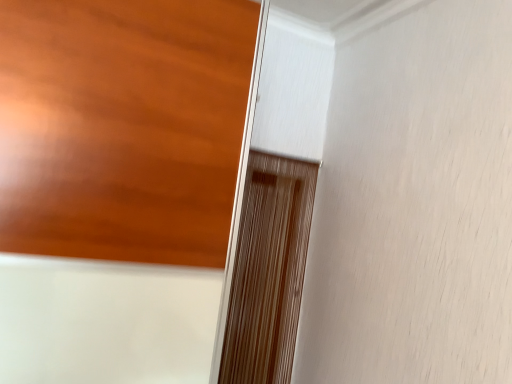
Where is `wooden screen door at center`? This screenshot has width=512, height=384. wooden screen door at center is located at coordinates (268, 270).

The width and height of the screenshot is (512, 384). Describe the element at coordinates (268, 270) in the screenshot. I see `wooden screen door at center` at that location.

Measure the distance between wooden screen door at center and camera.

wooden screen door at center is 5.74 feet away from camera.

In order to face wooden screen door at center, should I rotate leftwards or rightwards?

You should look right and rotate roughly 1.880 degrees.

This screenshot has height=384, width=512. In order to click on wooden screen door at center in this screenshot , I will do `click(268, 270)`.